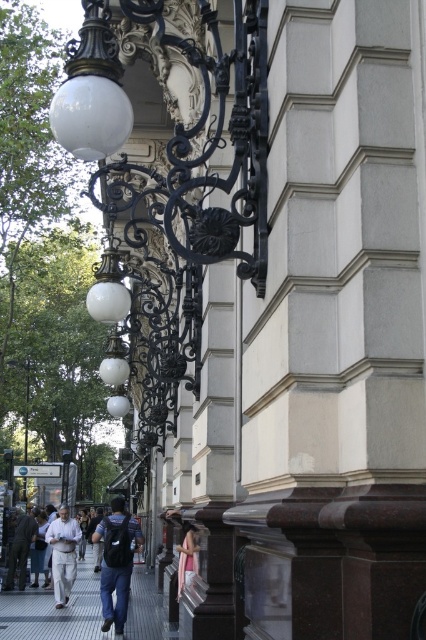
Question: Which of the following is the farthest from the observer?

Choices:
 (A) (112, 577)
 (B) (184, 552)
 (C) (23, 528)

Answer: (C)

Question: Does dark blue jeans at center have a larger size compared to matte black street light at lower left?

Choices:
 (A) yes
 (B) no

Answer: (B)

Question: Which object appears closest to the camera in this image?

Choices:
 (A) light pink fabric at lower center
 (B) gray concrete pavement at lower left

Answer: (A)

Question: Which of the following is the closest to the observer?

Choices:
 (A) (69, 538)
 (B) (16, 524)
 (C) (120, 538)

Answer: (C)

Question: Does white cotton shirt at center have a lesser width compared to light pink fabric at lower center?

Choices:
 (A) no
 (B) yes

Answer: (A)

Question: Does gray concrete pavement at lower left appear on the right side of dark gray fabric jacket at lower left?

Choices:
 (A) no
 (B) yes

Answer: (B)